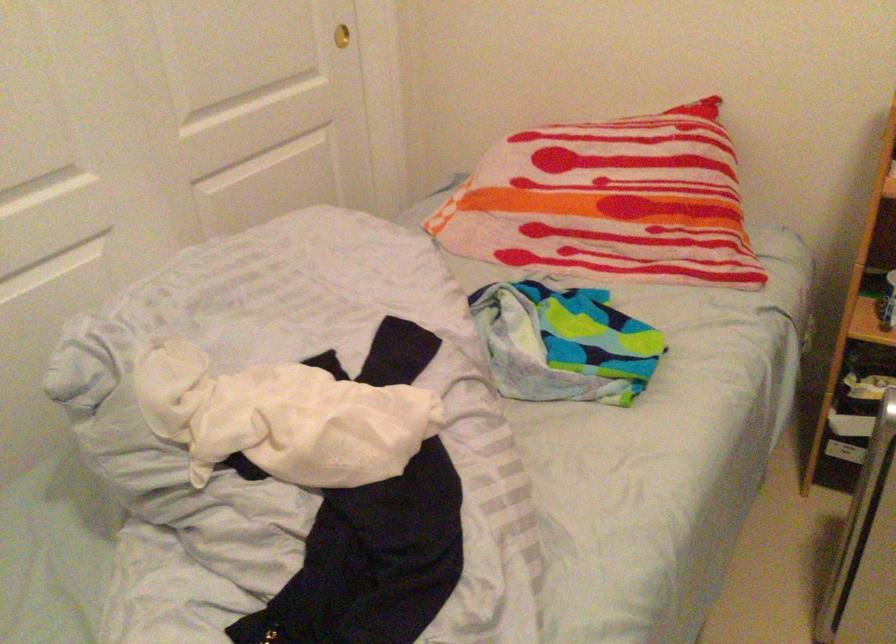
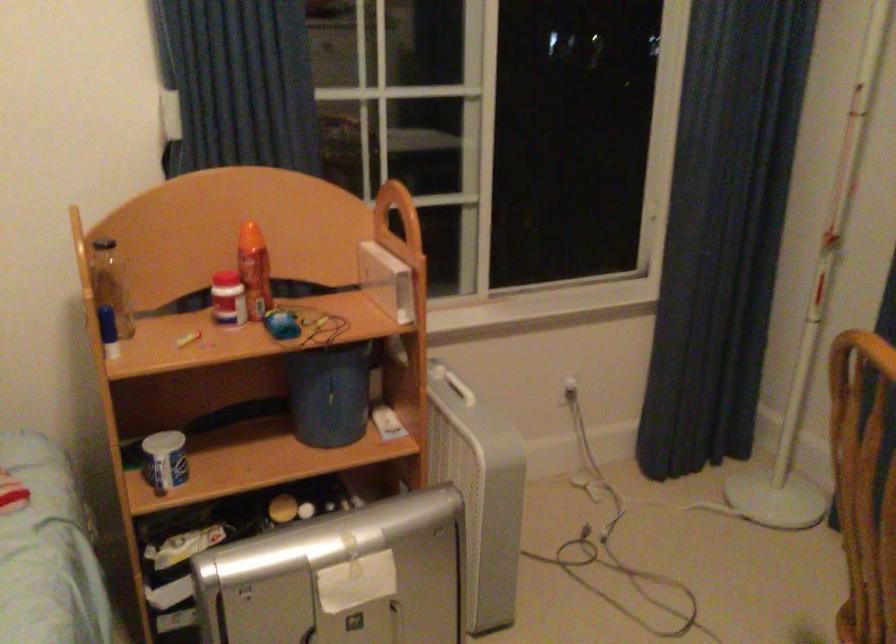
Question: The camera is either moving clockwise (left) or counter-clockwise (right) around the object. The first image is from the beginning of the video and the second image is from the end. Is the camera moving left or right when shooting the video?

Choices:
 (A) Left
 (B) Right

Answer: (A)